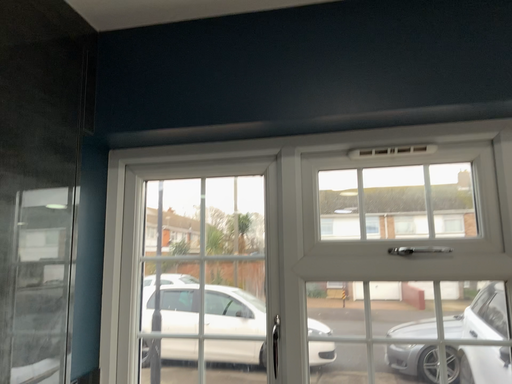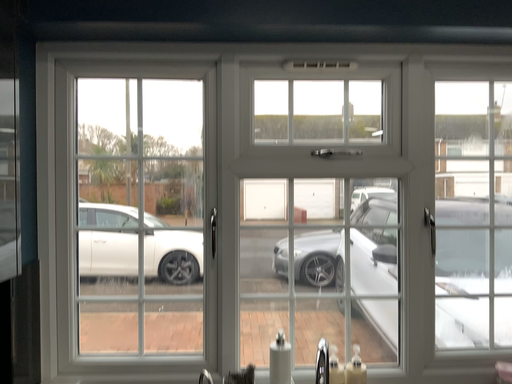
Question: How did the camera likely rotate when shooting the video?

Choices:
 (A) rotated left
 (B) rotated right

Answer: (B)